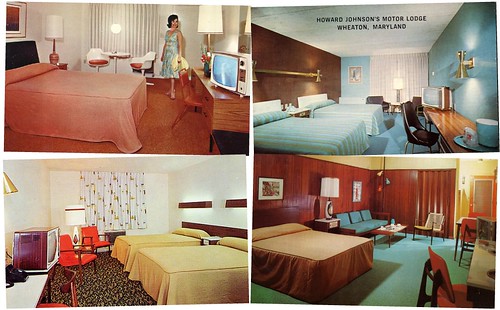
The width and height of the screenshot is (500, 310). What are the coordinates of `curtains` in the screenshot? It's located at (126, 202), (128, 29), (408, 70), (438, 192).